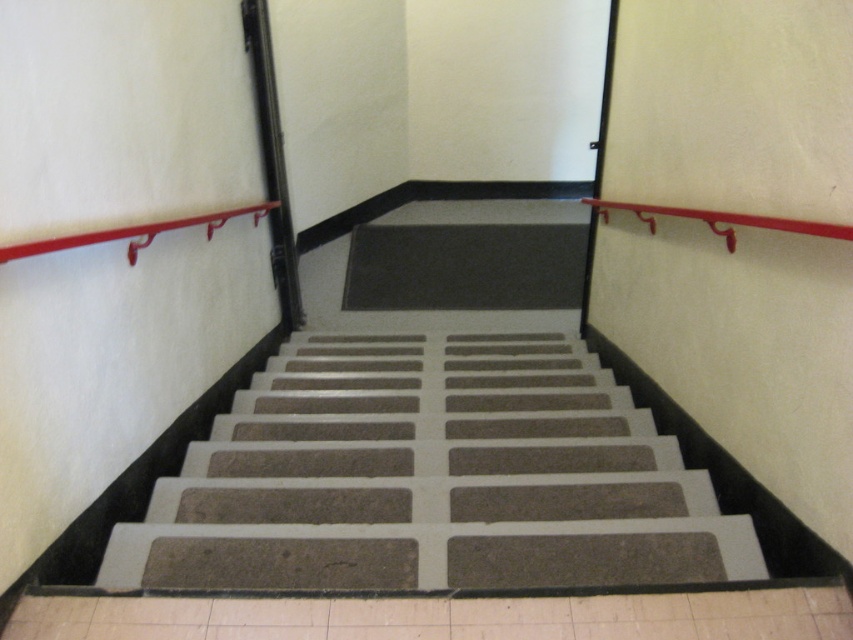
You are standing at the bottom of the staircase and want to grab the metallic red handrail at upper right. Is the textured gray carpet at center blocking your direct path to it?

The metallic red handrail at upper right is behind the textured gray carpet at center, so the carpet is blocking your direct path to the handrail.

You are standing at the bottom of the staircase and want to place a small potted plant between the textured gray carpet at center and the matte red handrail at upper left. Based on their heights, which object should the plant be placed closer to?

The textured gray carpet at center has a greater height compared to the matte red handrail at upper left. Therefore, the plant should be placed closer to the matte red handrail at upper left to ensure stability and visibility.